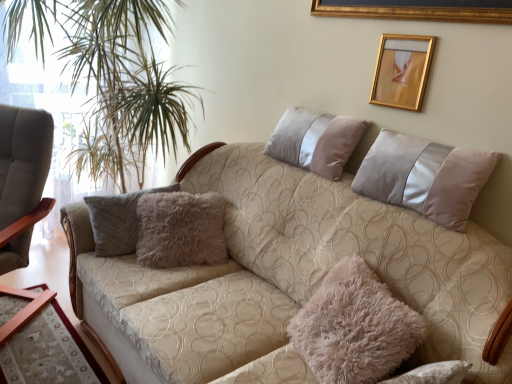
What is the approximate width of matte gray armchair at left?

matte gray armchair at left is 22.67 inches in width.

Describe the element at coordinates (287, 270) in the screenshot. I see `beige fabric couch at center` at that location.

What do you see at coordinates (402, 71) in the screenshot? I see `gold metallic picture frame at upper right` at bounding box center [402, 71].

Where is `matte gray armchair at left`? This screenshot has height=384, width=512. matte gray armchair at left is located at coordinates pos(23,160).

How far apart are fuzzy beige pillow at center, the 2th pillow from the top, and matte gray armchair at left?

The distance of fuzzy beige pillow at center, the 2th pillow from the top, from matte gray armchair at left is 1.51 meters.

Is fuzzy beige pillow at center, the 1th pillow from the bottom, positioned with its back to matte gray armchair at left?

No, fuzzy beige pillow at center, the 1th pillow from the bottom, is not facing away from matte gray armchair at left.

From a real-world perspective, which is physically above, fuzzy beige pillow at center, the 1th pillow from the bottom, or matte gray armchair at left?

In real-world perspective, fuzzy beige pillow at center, the 1th pillow from the bottom, is above.

Is point (318, 294) less distant than point (22, 205)?

Yes, it is.

In the scene shown: Looking at their sizes, would you say gold metallic picture frame at upper right is wider or thinner than fuzzy beige pillow at center, the 2th pillow from the top?

In the image, gold metallic picture frame at upper right appears to be more narrow than fuzzy beige pillow at center, the 2th pillow from the top.

Considering the relative positions of gold metallic picture frame at upper right and fuzzy beige pillow at center, the 1th pillow from the bottom, in the image provided, is gold metallic picture frame at upper right to the left of fuzzy beige pillow at center, the 1th pillow from the bottom, from the viewer's perspective?

No.

How different are the orientations of gold metallic picture frame at upper right and fuzzy beige pillow at center, the 1th pillow from the bottom, in degrees?

They differ by 91.8 degrees in their facing directions.

Consider the image. Is gold metallic picture frame at upper right looking in the opposite direction of fuzzy beige pillow at center, the 2th pillow from the top?

No, fuzzy beige pillow at center, the 2th pillow from the top, is not at the back of gold metallic picture frame at upper right.

Is fuzzy beige pillow at center, the 2th pillow from the top, facing towards beige fabric couch at center?

Yes, fuzzy beige pillow at center, the 2th pillow from the top, is aimed at beige fabric couch at center.

From a real-world perspective, is fuzzy beige pillow at center, the 2th pillow from the top, located higher than beige fabric couch at center?

Yes, from a real-world perspective, fuzzy beige pillow at center, the 2th pillow from the top, is on top of beige fabric couch at center.

Consider the image. From the image's perspective, would you say fuzzy beige pillow at center, the 2th pillow from the top, is shown under beige fabric couch at center?

Indeed, from the image's perspective, fuzzy beige pillow at center, the 2th pillow from the top, is shown beneath beige fabric couch at center.

Is fuzzy beige pillow at center, the 2th pillow from the top, inside the boundaries of beige fabric couch at center, or outside?

fuzzy beige pillow at center, the 2th pillow from the top, can be found inside beige fabric couch at center.

Is green leafy plant at left not within gold metallic picture frame at upper right?

Indeed, green leafy plant at left is completely outside gold metallic picture frame at upper right.

Find the location of a particular element. The width and height of the screenshot is (512, 384). plant located below the gold metallic picture frame at upper right (from the image's perspective) is located at coordinates (x=110, y=61).

From the image's perspective, relative to gold metallic picture frame at upper right, is green leafy plant at left above or below?

green leafy plant at left is below gold metallic picture frame at upper right.

Does fuzzy beige pillow at center, the 2th pillow from the top, have a lesser width compared to green leafy plant at left?

Yes, fuzzy beige pillow at center, the 2th pillow from the top, is thinner than green leafy plant at left.

Which object is positioned more to the left, fuzzy beige pillow at center, the 1th pillow from the bottom, or green leafy plant at left?

green leafy plant at left.

Is green leafy plant at left located within fuzzy beige pillow at center, the 2th pillow from the top?

No, green leafy plant at left is not a part of fuzzy beige pillow at center, the 2th pillow from the top.

Does fuzzy beige pillow at center, the 2th pillow from the top, lie in front of green leafy plant at left?

Yes, it is.

Measure the distance from gold metallic picture frame at upper right to silky beige pillow at upper right, positioned as the 1th pillow in top-to-bottom order.

gold metallic picture frame at upper right and silky beige pillow at upper right, positioned as the 1th pillow in top-to-bottom order, are 31.35 centimeters apart.

Can you confirm if gold metallic picture frame at upper right is taller than silky beige pillow at upper right, the 2th pillow in the bottom-to-top sequence?

In fact, gold metallic picture frame at upper right may be shorter than silky beige pillow at upper right, the 2th pillow in the bottom-to-top sequence.

In the image, there is a silky beige pillow at upper right, positioned as the 1th pillow in top-to-bottom order. Identify the location of picture frame above it (from the image's perspective). (402, 71).

Does gold metallic picture frame at upper right lie in front of silky beige pillow at upper right, positioned as the 1th pillow in top-to-bottom order?

No, gold metallic picture frame at upper right is behind silky beige pillow at upper right, positioned as the 1th pillow in top-to-bottom order.

Considering the positions of objects gold metallic picture frame at upper right and beige fabric couch at center in the image provided, who is in front, gold metallic picture frame at upper right or beige fabric couch at center?

Positioned in front is beige fabric couch at center.

Considering the sizes of objects gold metallic picture frame at upper right and beige fabric couch at center in the image provided, who is bigger, gold metallic picture frame at upper right or beige fabric couch at center?

With larger size is beige fabric couch at center.

Is gold metallic picture frame at upper right aimed at beige fabric couch at center?

No, gold metallic picture frame at upper right is not facing towards beige fabric couch at center.

From the image's perspective, is gold metallic picture frame at upper right above beige fabric couch at center?

Correct, gold metallic picture frame at upper right appears higher than beige fabric couch at center in the image.

Find the location of a particular element. chair above the fuzzy beige pillow at center, the 2th pillow from the top (from the image's perspective) is located at coordinates (23, 160).

Identify the location of picture frame behind the fuzzy beige pillow at center, the 1th pillow from the bottom. (402, 71).

When comparing their distances from silky beige pillow at upper right, the 2th pillow in the bottom-to-top sequence, does beige fabric couch at center or green leafy plant at left seem further?

green leafy plant at left is positioned further to the anchor silky beige pillow at upper right, the 2th pillow in the bottom-to-top sequence.

Consider the image. When comparing their distances from beige fabric couch at center, does green leafy plant at left or gold metallic picture frame at upper right seem closer?

gold metallic picture frame at upper right lies closer to beige fabric couch at center than the other object.

Estimate the real-world distances between objects in this image. Which object is closer to gold metallic picture frame at upper right, green leafy plant at left or beige fabric couch at center?

Among the two, beige fabric couch at center is located nearer to gold metallic picture frame at upper right.

When comparing their distances from fuzzy beige pillow at center, the 1th pillow from the bottom, does silky beige pillow at upper right, the 2th pillow in the bottom-to-top sequence, or gold metallic picture frame at upper right seem further?

gold metallic picture frame at upper right lies further to fuzzy beige pillow at center, the 1th pillow from the bottom, than the other object.

When comparing their distances from gold metallic picture frame at upper right, does green leafy plant at left or silky beige pillow at upper right, positioned as the 1th pillow in top-to-bottom order, seem closer?

Based on the image, silky beige pillow at upper right, positioned as the 1th pillow in top-to-bottom order, appears to be nearer to gold metallic picture frame at upper right.

When comparing their distances from gold metallic picture frame at upper right, does matte gray armchair at left or silky beige pillow at upper right, the 2th pillow in the bottom-to-top sequence, seem closer?

Based on the image, silky beige pillow at upper right, the 2th pillow in the bottom-to-top sequence, appears to be nearer to gold metallic picture frame at upper right.

Which object lies further to the anchor point fuzzy beige pillow at center, the 1th pillow from the bottom, gold metallic picture frame at upper right or green leafy plant at left?

green leafy plant at left is positioned further to the anchor fuzzy beige pillow at center, the 1th pillow from the bottom.

In the scene shown: Considering their positions, is silky beige pillow at upper right, positioned as the 1th pillow in top-to-bottom order, positioned closer to beige fabric couch at center than green leafy plant at left?

Among the two, silky beige pillow at upper right, positioned as the 1th pillow in top-to-bottom order, is located nearer to beige fabric couch at center.

The height and width of the screenshot is (384, 512). Find the location of `studio couch between green leafy plant at left and silky beige pillow at upper right, positioned as the 1th pillow in top-to-bottom order, from left to right`. studio couch between green leafy plant at left and silky beige pillow at upper right, positioned as the 1th pillow in top-to-bottom order, from left to right is located at coordinates (287, 270).

This screenshot has height=384, width=512. Identify the location of studio couch between green leafy plant at left and gold metallic picture frame at upper right. click(x=287, y=270).

Locate an element on the screen. Image resolution: width=512 pixels, height=384 pixels. plant between matte gray armchair at left and gold metallic picture frame at upper right in the horizontal direction is located at coordinates (110, 61).

I want to click on plant between matte gray armchair at left and beige fabric couch at center, so click(x=110, y=61).